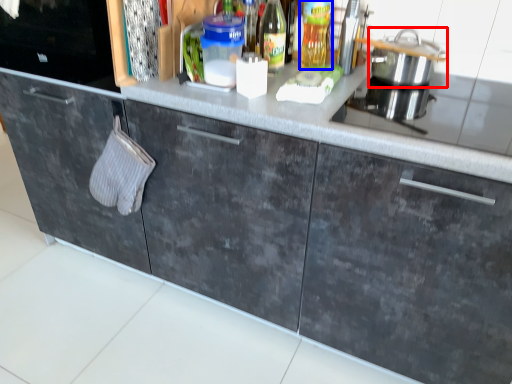
Question: Which point is closer to the camera, kitchen appliance (highlighted by a red box) or bottle (highlighted by a blue box)?

Choices:
 (A) kitchen appliance
 (B) bottle

Answer: (A)